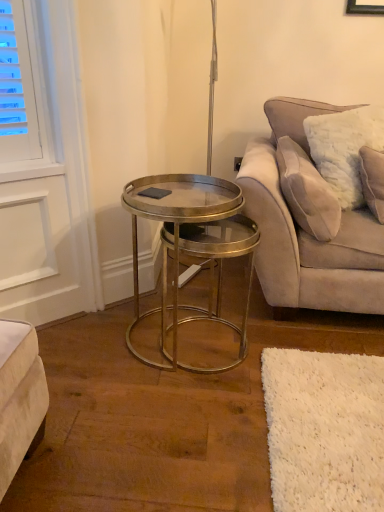
Question: In the image, is metallic/glass coffee table at center on the left side or the right side of velvet beige couch at right?

Choices:
 (A) right
 (B) left

Answer: (B)

Question: Is metallic/glass coffee table at center bigger or smaller than velvet beige couch at right?

Choices:
 (A) small
 (B) big

Answer: (A)

Question: Estimate the real-world distances between objects in this image. Which object is closer to the velvet beige couch at right?

Choices:
 (A) metallic/glass coffee table at center
 (B) white fluffy pillow at upper right

Answer: (B)

Question: Which object is the closest to the metallic/glass coffee table at center?

Choices:
 (A) velvet beige couch at right
 (B) white fluffy pillow at upper right

Answer: (A)